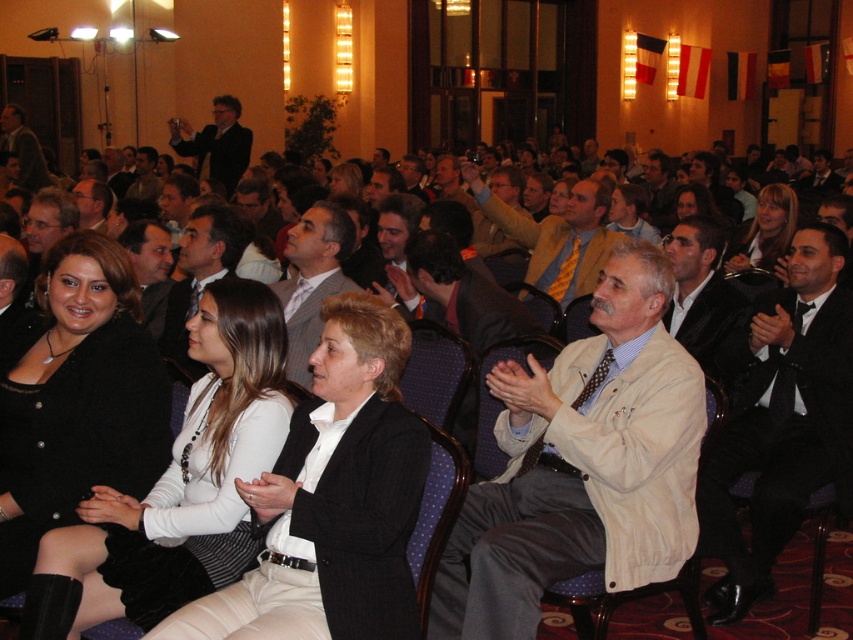
You are an event planner checking the seating arrangement. You notice the beige fabric jacket at center and the blonde hair at center. Which one is located lower in the image?

The beige fabric jacket at center is positioned under blonde hair at center, so it is located lower in the image.

You are an event organizer who needs to arrange seating for two guests. You have two items of clothing in the scene to consider for their attire preferences. Which item of clothing is smaller in size between the black fabric dress at lower left and the black matte jacket at lower left?

The black fabric dress at lower left is smaller than the black matte jacket at lower left.

You are standing at the origin point of the coordinate system in the image, which is the bottom left corner. You need to locate the black matte jacket at lower left. What are its coordinates?

The coordinates of the black matte jacket at lower left are at point (76,397).